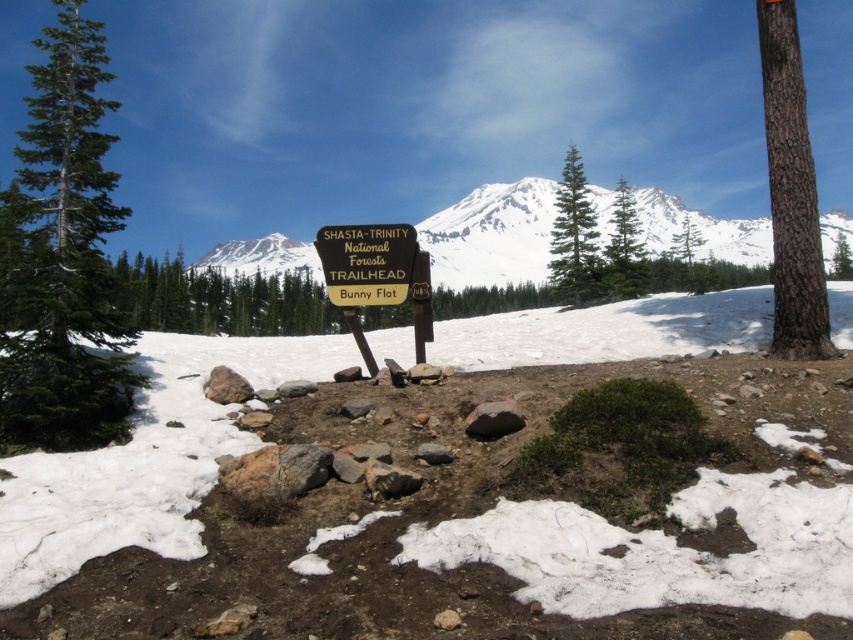
Question: Can you confirm if green matte tree at center is positioned to the left of green textured tree at upper right?

Choices:
 (A) no
 (B) yes

Answer: (B)

Question: Does snowy white mountain at center have a greater width compared to green textured pine tree at center?

Choices:
 (A) yes
 (B) no

Answer: (A)

Question: Which of the following is the farthest from the observer?

Choices:
 (A) brown rough bark tree at right
 (B) green textured tree at left
 (C) green textured tree at upper right

Answer: (C)

Question: Which of the following is the farthest from the observer?

Choices:
 (A) brown rough bark tree at right
 (B) green textured tree at upper right
 (C) yellow wood sign at center
 (D) snowy white mountain at center

Answer: (B)

Question: In this image, where is green textured tree at left located relative to snowy white mountain at center?

Choices:
 (A) left
 (B) right

Answer: (A)

Question: Which object is farther from the camera taking this photo?

Choices:
 (A) yellow wood sign at center
 (B) green textured tree at left
 (C) green textured pine tree at upper center

Answer: (C)